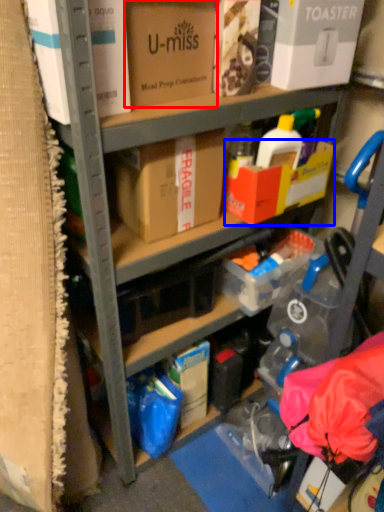
Question: Which point is closer to the camera, box (highlighted by a red box) or box (highlighted by a blue box)?

Choices:
 (A) box
 (B) box

Answer: (A)